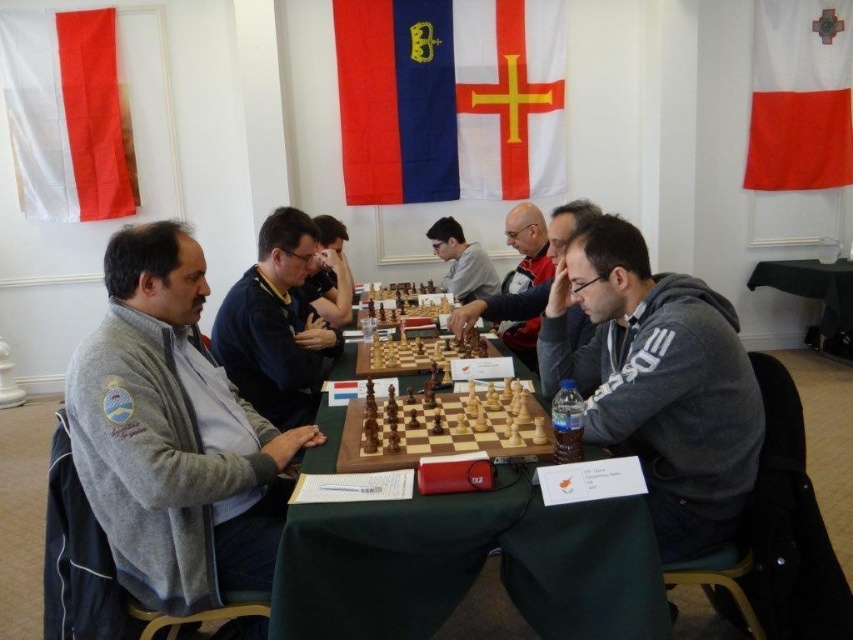
Question: Is green fabric table at center behind green fabric table at lower right?

Choices:
 (A) yes
 (B) no

Answer: (B)

Question: Which point is closer to the camera taking this photo?

Choices:
 (A) (343, 624)
 (B) (502, 180)
 (C) (485, 305)
 (D) (607, 216)

Answer: (A)

Question: Does wooden chess set at center appear on the right side of gray fleece jacket at center?

Choices:
 (A) yes
 (B) no

Answer: (B)

Question: Which object is farther from the camera taking this photo?

Choices:
 (A) white fabric flag at upper center
 (B) white fabric flag at upper right
 (C) white fabric flag at upper left
 (D) blue fabric flag at upper center

Answer: (B)

Question: Which object is closer to the camera taking this photo?

Choices:
 (A) dark blue sweater at center
 (B) wooden chess set at center
 (C) gray fleece at center

Answer: (C)

Question: Does gray fleece at center appear under blue fabric flag at upper center?

Choices:
 (A) no
 (B) yes

Answer: (B)